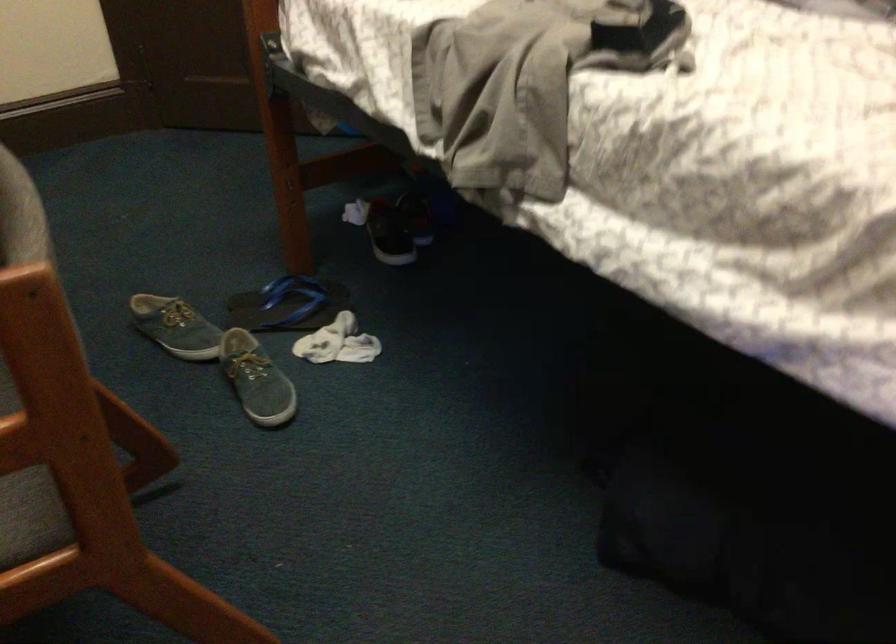
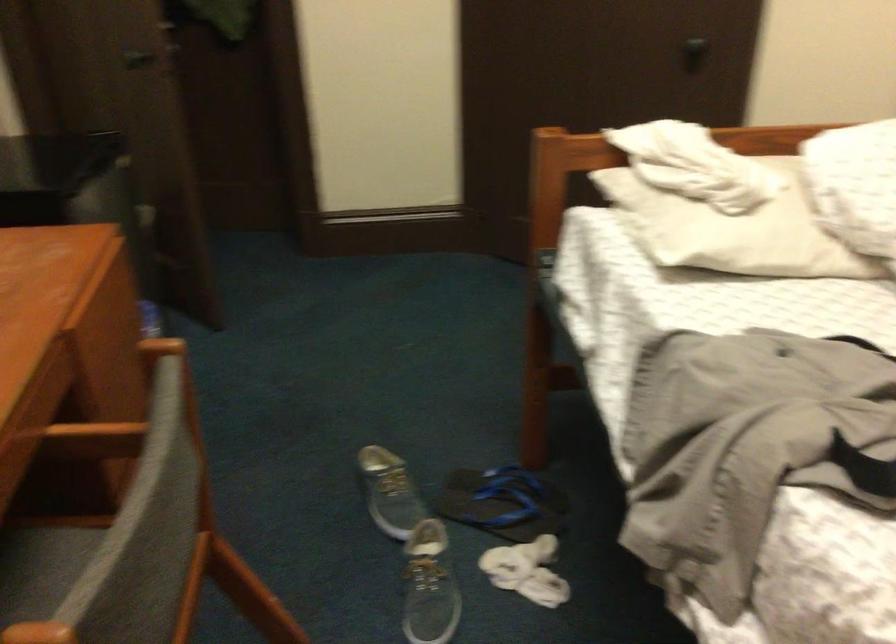
Which direction would the cameraman need to move to produce the second image?

The cameraman walked toward right, forward.